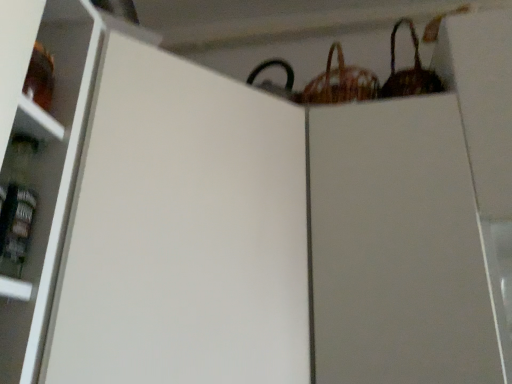
Question: From a real-world perspective, does woven brown basket at upper right, the first basket from the left, sit lower than white matte cabinet at center?

Choices:
 (A) yes
 (B) no

Answer: (B)

Question: Is woven brown basket at upper right, the first basket from the left, aimed at white matte cabinet at center?

Choices:
 (A) no
 (B) yes

Answer: (A)

Question: Is woven brown basket at upper right, the first basket from the left, far away from white matte cabinet at center?

Choices:
 (A) yes
 (B) no

Answer: (B)

Question: From a real-world perspective, is woven brown basket at upper right, the 2th basket viewed from the right, located higher than white matte cabinet at center?

Choices:
 (A) no
 (B) yes

Answer: (B)

Question: Can you confirm if woven brown basket at upper right, the 2th basket viewed from the right, is positioned to the right of white matte cabinet at center?

Choices:
 (A) no
 (B) yes

Answer: (B)

Question: Is woven brown basket at upper right, the 2th basket viewed from the right, taller or shorter than white matte cabinet at center?

Choices:
 (A) tall
 (B) short

Answer: (B)

Question: Considering the positions of woven brown basket at upper right, the 2th basket viewed from the right, and white matte cabinet at center in the image, is woven brown basket at upper right, the 2th basket viewed from the right, bigger or smaller than white matte cabinet at center?

Choices:
 (A) big
 (B) small

Answer: (B)

Question: From a real-world perspective, is woven brown basket at upper right, the 2th basket viewed from the right, physically located above or below white matte cabinet at center?

Choices:
 (A) above
 (B) below

Answer: (A)

Question: From the image's perspective, is woven brown basket at upper right, the first basket from the left, located above or below white matte cabinet at center?

Choices:
 (A) above
 (B) below

Answer: (A)

Question: Considering the positions of white matte cabinet at center and woven brown basket at upper right, the 2th basket from the left, in the image, is white matte cabinet at center taller or shorter than woven brown basket at upper right, the 2th basket from the left,?

Choices:
 (A) short
 (B) tall

Answer: (B)

Question: From a real-world perspective, is white matte cabinet at center above or below woven brown basket at upper right, arranged as the 1th basket when viewed from the right?

Choices:
 (A) below
 (B) above

Answer: (A)

Question: Considering the positions of point (198, 362) and point (381, 91), is point (198, 362) closer or farther from the camera than point (381, 91)?

Choices:
 (A) closer
 (B) farther

Answer: (A)

Question: Is white matte cabinet at center spatially inside woven brown basket at upper right, arranged as the 1th basket when viewed from the right, or outside of it?

Choices:
 (A) inside
 (B) outside

Answer: (B)

Question: Is point (104, 127) positioned closer to the camera than point (330, 76)?

Choices:
 (A) farther
 (B) closer

Answer: (B)

Question: Is white matte cabinet at center wider or thinner than woven brown basket at upper right, the 2th basket viewed from the right?

Choices:
 (A) thin
 (B) wide

Answer: (B)